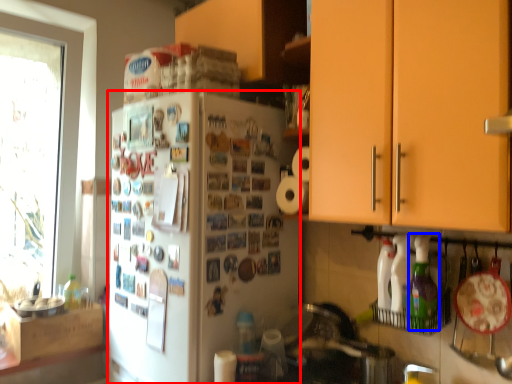
Question: Which of the following is the farthest to the observer, refrigerator (highlighted by a red box) or bottle (highlighted by a blue box)?

Choices:
 (A) refrigerator
 (B) bottle

Answer: (A)